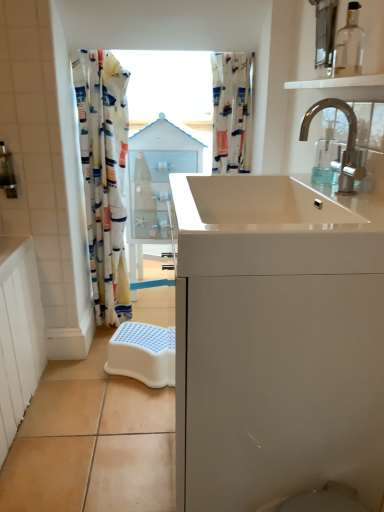
Question: Is point (157, 159) closer or farther from the camera than point (241, 98)?

Choices:
 (A) farther
 (B) closer

Answer: (A)

Question: From their relative heights in the image, would you say white glossy medicine cabinet at center is taller or shorter than white fabric shower curtain at upper center?

Choices:
 (A) tall
 (B) short

Answer: (A)

Question: Based on their relative distances, which object is farther from the white fabric curtain at left?

Choices:
 (A) white glossy medicine cabinet at center
 (B) transparent glass bottle at upper right
 (C) clear plastic soap dispenser at upper right
 (D) chrome metallic faucet at upper right
 (E) transparent glass shelf at upper right

Answer: (B)

Question: Which object is the farthest from the white fabric shower curtain at upper center?

Choices:
 (A) white glossy medicine cabinet at center
 (B) transparent glass shelf at upper right
 (C) white glossy sink at center
 (D) transparent glass bottle at upper right
 (E) clear plastic soap dispenser at upper right

Answer: (D)